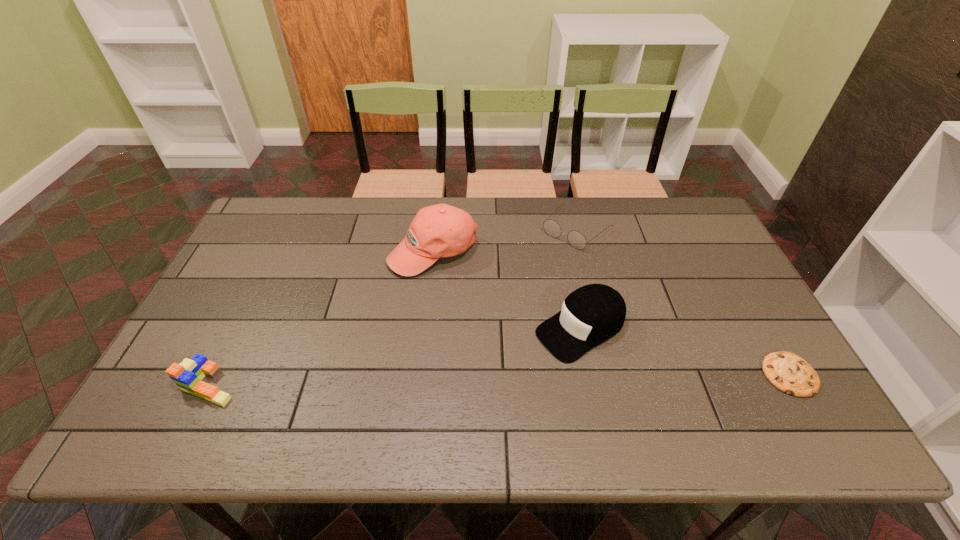
Identify which object is the second closest to the fourth object from right to left. Please provide its 2D coordinates. Your answer should be formatted as a tuple, i.e. [(x, y)], where the tuple contains the x and y coordinates of a point satisfying the conditions above.

[(576, 239)]

Identify which object is the closest to the fourth tallest object. Please provide its 2D coordinates. Your answer should be formatted as a tuple, i.e. [(x, y)], where the tuple contains the x and y coordinates of a point satisfying the conditions above.

[(590, 315)]

The height and width of the screenshot is (540, 960). What are the coordinates of `vacant point that satisfies the following two spatial constraints: 1. on the back side of the baseball cap; 2. on the left side of the spectacles` in the screenshot? It's located at (436, 230).

At what (x,y) coordinates should I click in order to perform the action: click on free spot that satisfies the following two spatial constraints: 1. on the back side of the baseball cap; 2. on the left side of the Lego. Please return your answer as a coordinate pair (x, y). Image resolution: width=960 pixels, height=540 pixels. Looking at the image, I should click on (276, 251).